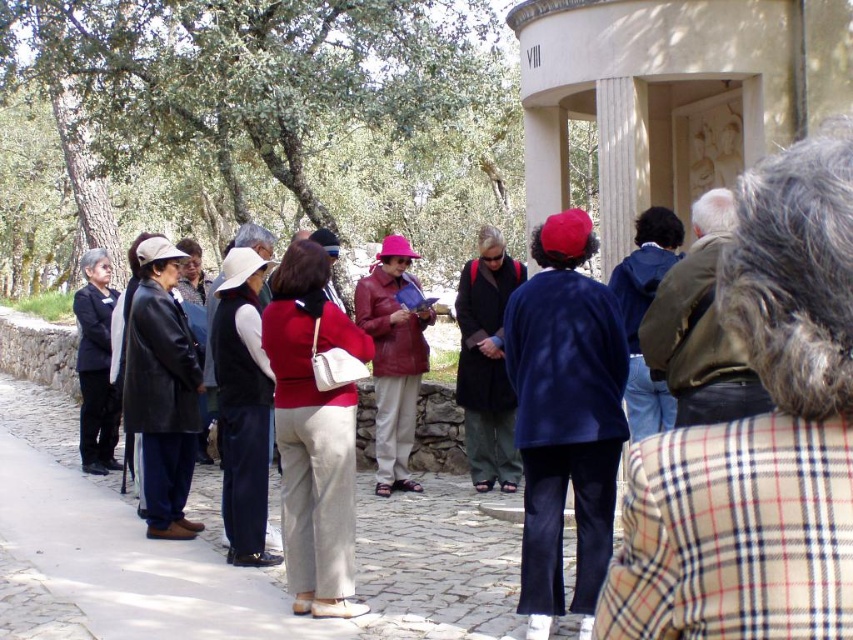
You are a photographer trying to capture a group photo of the plaid fabric jacket at center and the navy blue fabric jacket at center. Which jacket should you focus on first if you want to include both in the frame without moving the camera?

The plaid fabric jacket at center is above the navy blue fabric jacket at center, so focusing on the plaid fabric jacket at center first will ensure both are in the frame as the navy blue fabric jacket at center is positioned below it.

You are a tour guide standing at a historical site. You notice a participant wearing a navy blue fabric jacket at center who is 6.82 meters away from you. You want to hand them a pamphlet. Can you reach them without moving from your current position if your maximum reach is 2 meters?

The navy blue fabric jacket at center is 6.82 meters away from the viewer. Since your maximum reach is 2 meters, you cannot reach them without moving closer.

You are part of a tour group standing on a cobblestone path near a historical monument. You notice two jackets at the center of the scene. Which jacket is positioned to the left when looking at the plaid fabric jacket at center and the navy blue fabric jacket at center?

The plaid fabric jacket at center is to the left of the navy blue fabric jacket at center.